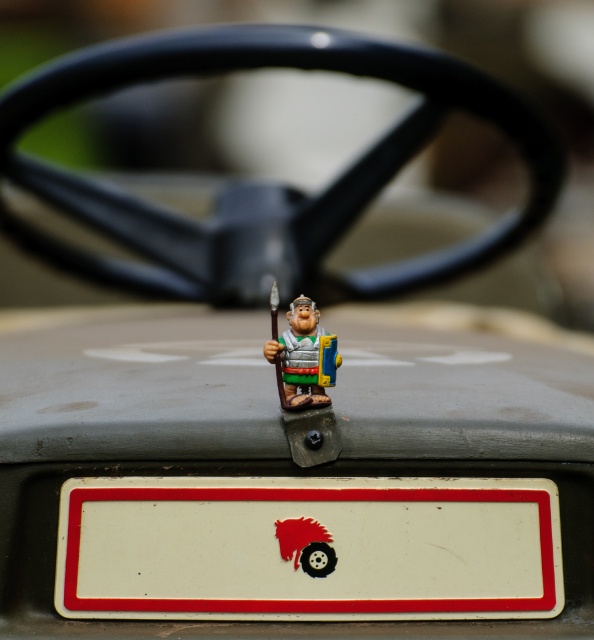
Does white plastic license plate at center have a larger size compared to matte plastic figurine at center?

Correct, white plastic license plate at center is larger in size than matte plastic figurine at center.

Which is in front, point (374, 602) or point (282, 364)?

Positioned in front is point (374, 602).

Does point (328, 500) lie in front of point (301, 406)?

No, (328, 500) is behind (301, 406).

In order to click on white plastic license plate at center in this screenshot , I will do `click(308, 548)`.